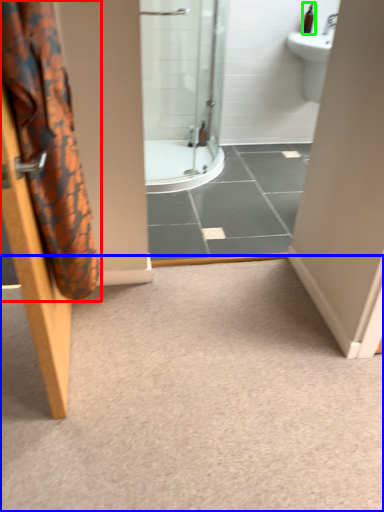
Question: Which is nearer to the shower curtain (highlighted by a red box)? plain (highlighted by a blue box) or toiletry (highlighted by a green box).

Choices:
 (A) plain
 (B) toiletry

Answer: (A)